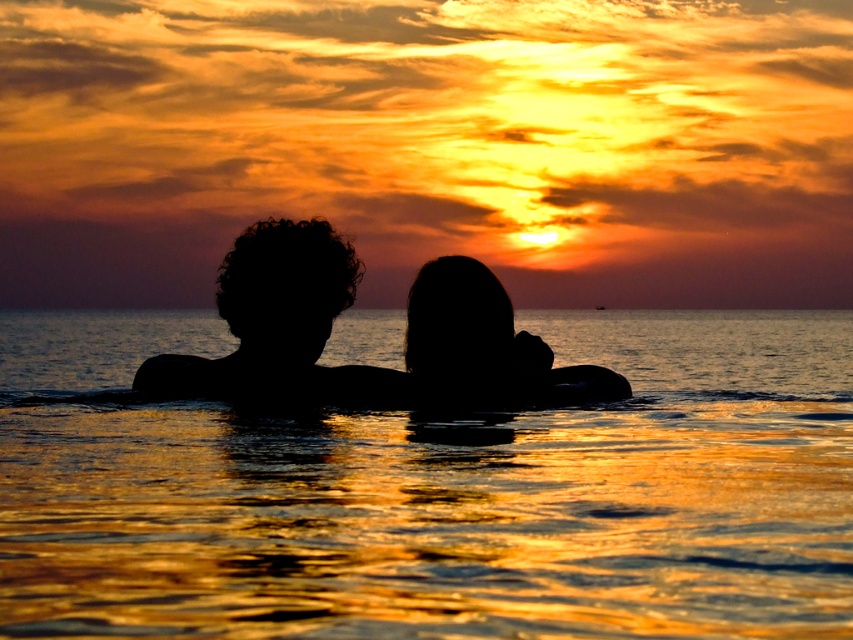
Question: Which point is closer to the camera?

Choices:
 (A) coord(503,355)
 (B) coord(698,369)
 (C) coord(282,237)

Answer: (C)

Question: Which of these objects is positioned closest to the silhouette hair at center?

Choices:
 (A) black matte hair at center
 (B) golden reflective water at center

Answer: (A)

Question: Considering the relative positions of golden reflective water at center and silhouette hair at center in the image provided, where is golden reflective water at center located with respect to silhouette hair at center?

Choices:
 (A) above
 (B) below

Answer: (A)

Question: Is the position of black matte hair at center less distant than that of silhouette hair at center?

Choices:
 (A) no
 (B) yes

Answer: (B)

Question: Estimate the real-world distances between objects in this image. Which object is closer to the black matte hair at center?

Choices:
 (A) silhouette hair at center
 (B) golden reflective water at center

Answer: (A)

Question: Considering the relative positions of black matte hair at center and silhouette hair at center in the image provided, where is black matte hair at center located with respect to silhouette hair at center?

Choices:
 (A) right
 (B) left

Answer: (B)